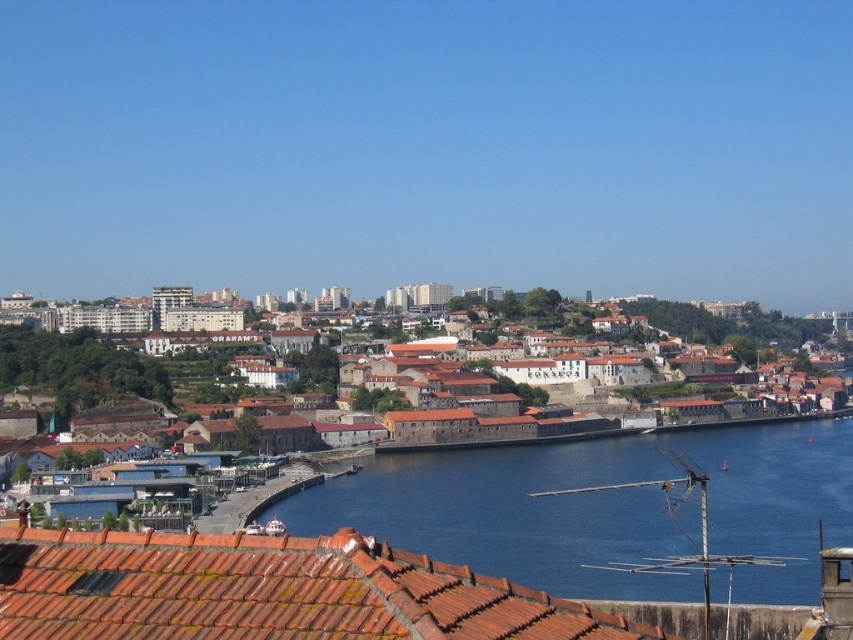
You are standing at the point marked as point (605, 508) in the coastal cityscape. What do you see directly in front of you?

At point (605, 508) lies blue water at center, so you would see blue water at center directly in front of you.

Consider the image. You are an architect reviewing this coastal cityscape. You need to determine the spatial relationship between the blue water at center and the terracotta tiles at lower center. Which object is located below the other?

The blue water at center is positioned under terracotta tiles at lower center, meaning the blue water at center is below the terracotta tiles at lower center.